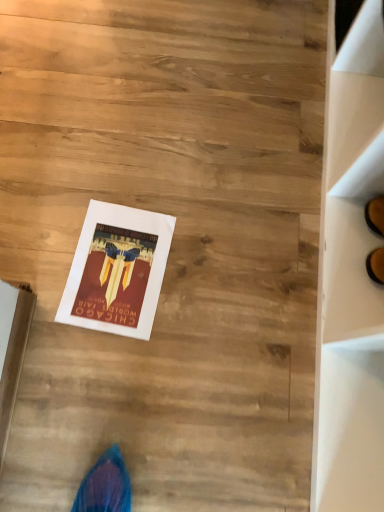
The height and width of the screenshot is (512, 384). I want to click on vacant space to the right of matte paper poster at center, so click(x=210, y=287).